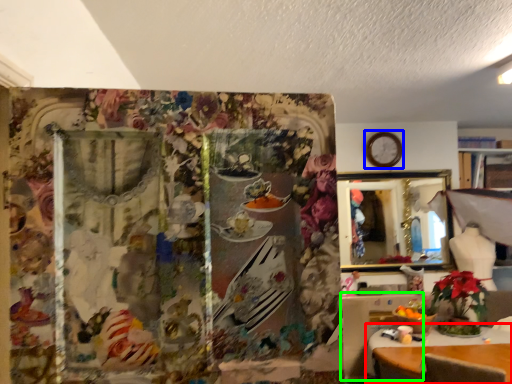
Question: Considering the real-world distances, which object is farthest from table (highlighted by a red box)? clock (highlighted by a blue box) or table (highlighted by a green box)?

Choices:
 (A) clock
 (B) table

Answer: (A)